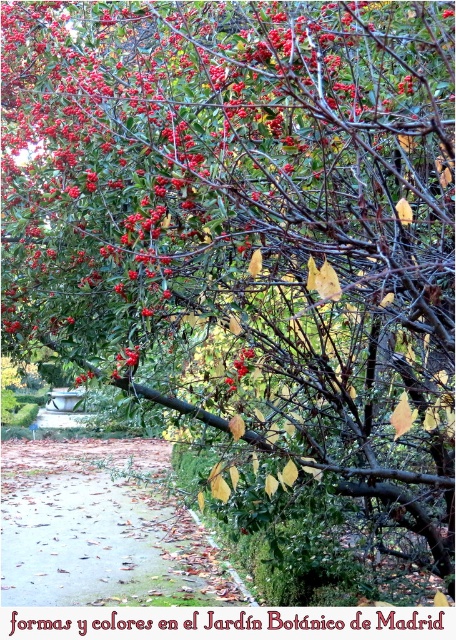
Question: Which point is farther to the camera?

Choices:
 (A) brown leafy path at lower left
 (B) smooth red berries at center

Answer: (A)

Question: Does brown leafy path at lower left have a smaller size compared to smooth red berries at center?

Choices:
 (A) yes
 (B) no

Answer: (B)

Question: Can you confirm if brown leafy path at lower left is positioned above smooth red berries at center?

Choices:
 (A) no
 (B) yes

Answer: (A)

Question: Which object appears farthest from the camera in this image?

Choices:
 (A) brown leafy path at lower left
 (B) smooth red berries at center

Answer: (A)

Question: In this image, where is brown leafy path at lower left located relative to smooth red berries at center?

Choices:
 (A) left
 (B) right

Answer: (A)